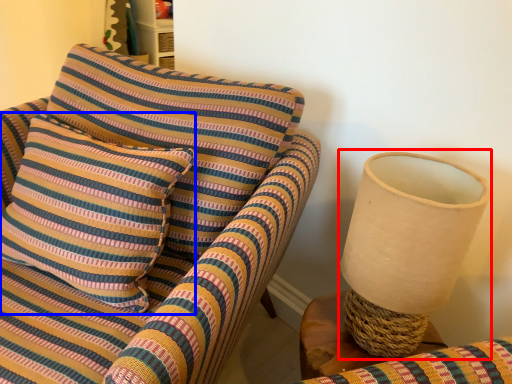
Question: Among these objects, which one is farthest to the camera, table lamp (highlighted by a red box) or pillow (highlighted by a blue box)?

Choices:
 (A) table lamp
 (B) pillow

Answer: (B)